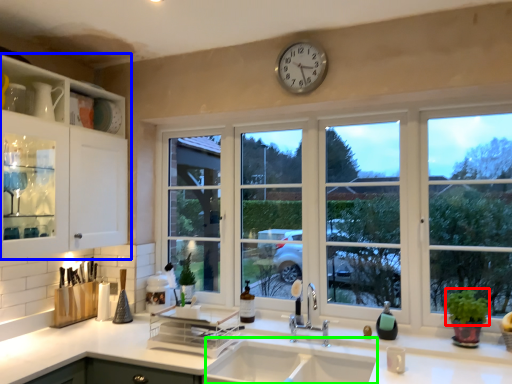
Question: Estimate the real-world distances between objects in this image. Which object is farther from plant (highlighted by a red box), cabinetry (highlighted by a blue box) or sink (highlighted by a green box)?

Choices:
 (A) cabinetry
 (B) sink

Answer: (A)